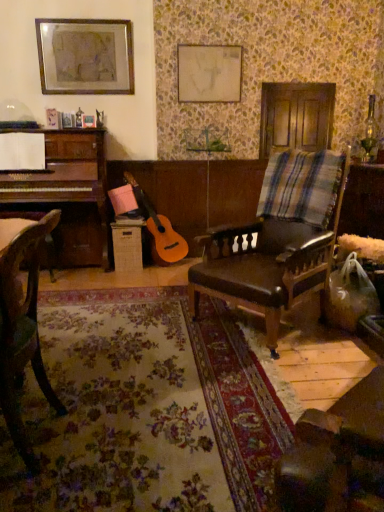
Question: Considering the positions of matte white canvas at upper center, which appears as the 1th picture frame when viewed from the right, and plaid fabric at right in the image, is matte white canvas at upper center, which appears as the 1th picture frame when viewed from the right, taller or shorter than plaid fabric at right?

Choices:
 (A) tall
 (B) short

Answer: (A)

Question: Does point click(215, 96) appear closer or farther from the camera than point click(271, 178)?

Choices:
 (A) closer
 (B) farther

Answer: (B)

Question: Estimate the real-world distances between objects in this image. Which object is farther from the brown leather chair at center, the 2th chair when ordered from left to right?

Choices:
 (A) matte white canvas at upper center, the 2th picture frame when ordered from left to right
 (B) metallic silver picture frame at upper left, which ranks as the first picture frame in left-to-right order
 (C) plaid fabric at right
 (D) wooden chair at left, the second chair viewed from the back

Answer: (B)

Question: Which is nearer to the metallic silver picture frame at upper left, the 2th picture frame viewed from the right?

Choices:
 (A) plaid fabric at right
 (B) wooden chair at left, which is the 1th chair from left to right
 (C) brown leather chair at center, marked as the first chair in a right-to-left arrangement
 (D) matte white canvas at upper center, which appears as the 1th picture frame when viewed from the right

Answer: (D)